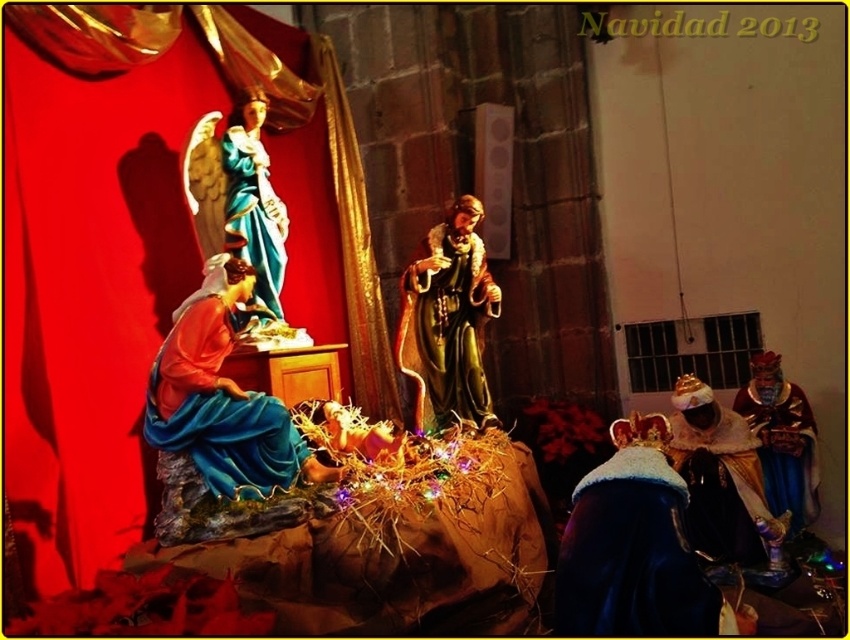
You are setting up a Christmas display and want to ensure the shiny gold statue at center is visible behind the matte blue fabric at center. Based on the scene description, will the statue be visible through the fabric?

The matte blue fabric at center is in front of the shiny gold statue at center, so the statue will be partially or fully obscured depending on the fabric transparency. Since the scene description mentions vibrant colors and festive glow, it implies the statue might still be visible due to lighting, but the exact visibility isn not specified.

You are setting up a nativity scene and need to place the gold textured crown at lower right. According to the image, where should you position it relative to the other elements?

The gold textured crown at lower right should be placed at point 0.747 on the x axis and 0.848 on the y axis.